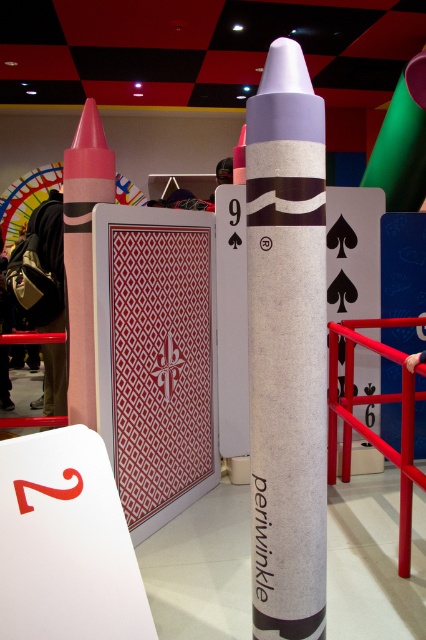
You are an artist planning to place a new sculpture between the matte paper crayon at center and the matte pink crayon at left. If the sculpture requires a space wider than the wider of the two crayons, which crayon determines the minimum width needed for the sculpture?

The matte pink crayon at left is wider than the matte paper crayon at center, so the minimum width needed for the sculpture must be at least the width of the matte pink crayon at left.